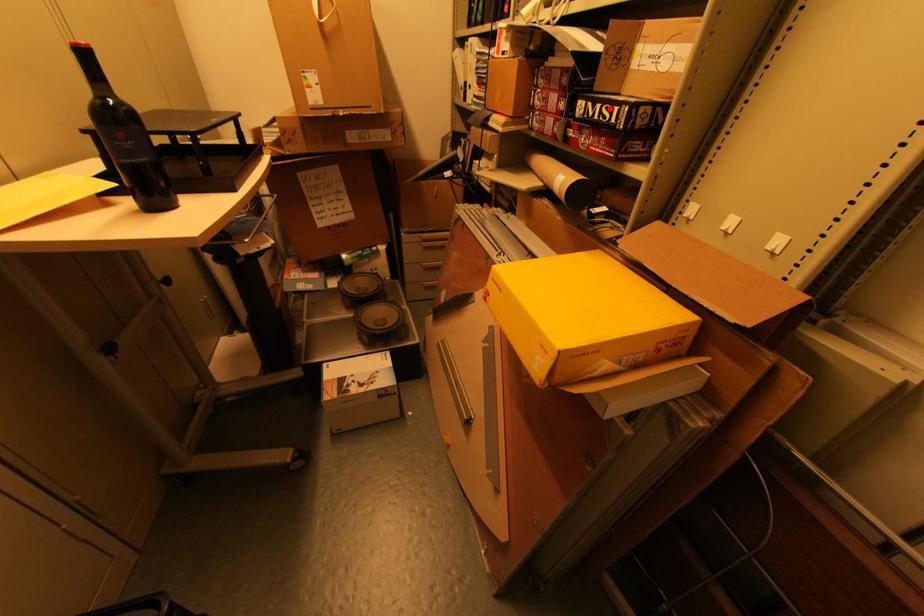
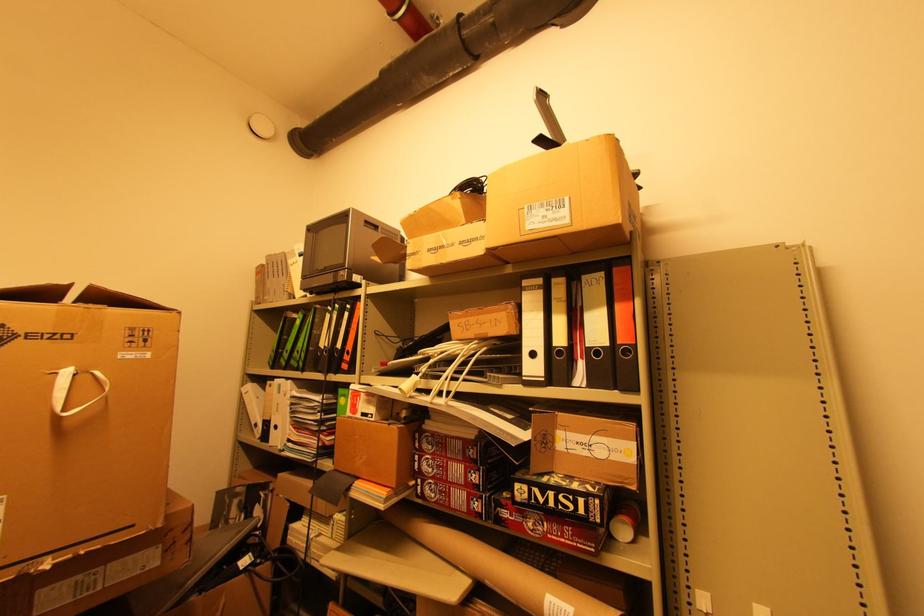
The point at the highlighted location is marked in the first image. Where is the corresponding point in the second image?

(568, 498)